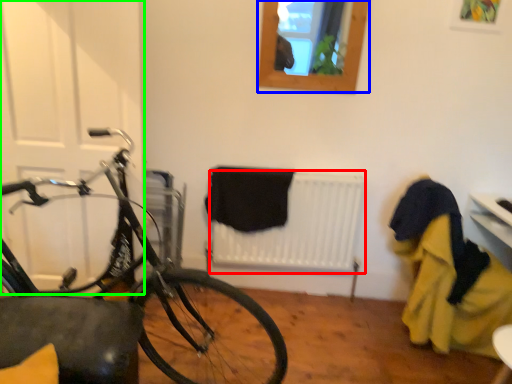
Question: Based on their relative distances, which object is farther from radiator (highlighted by a red box)? Choose from window (highlighted by a blue box) and door (highlighted by a green box).

Choices:
 (A) window
 (B) door

Answer: (B)